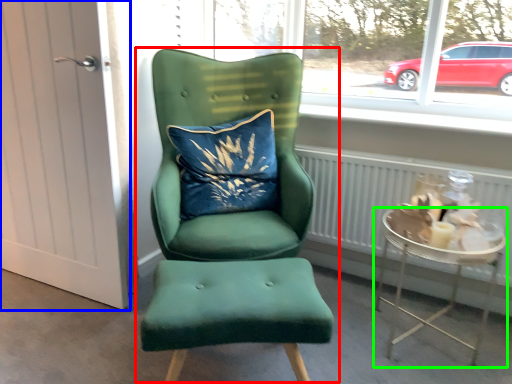
Question: Which is farther away from chair (highlighted by a red box)? door (highlighted by a blue box) or table (highlighted by a green box)?

Choices:
 (A) door
 (B) table

Answer: (B)